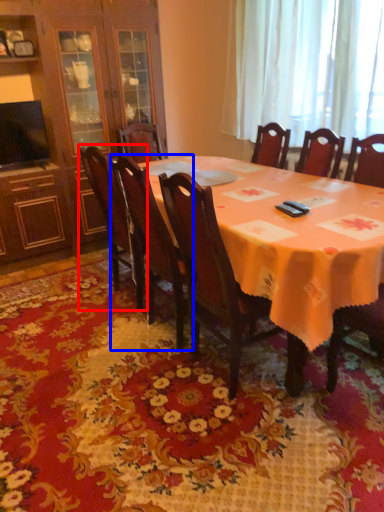
Question: Which of the following is the farthest to the observer, chair (highlighted by a red box) or chair (highlighted by a blue box)?

Choices:
 (A) chair
 (B) chair

Answer: (A)